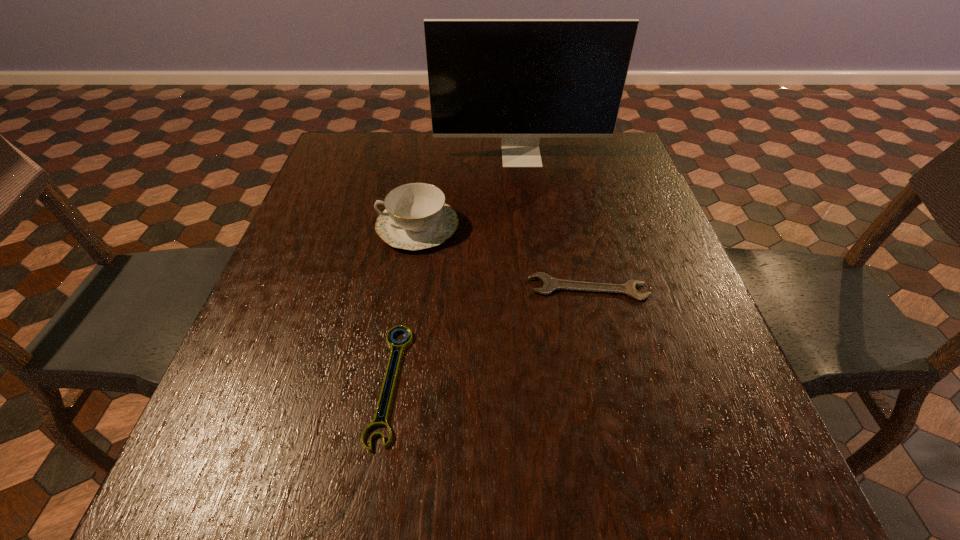
Find the location of a particular element. The width and height of the screenshot is (960, 540). free region that satisfies the following two spatial constraints: 1. on the front-facing side of the monitor; 2. on the left side of the farther wrench is located at coordinates (538, 288).